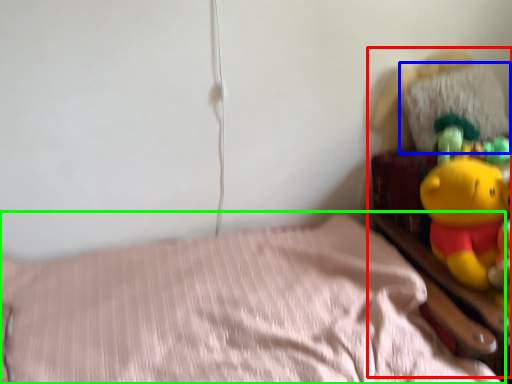
Question: Considering the real-world distances, which object is closest to toy (highlighted by a red box)? pillow (highlighted by a blue box) or bed (highlighted by a green box).

Choices:
 (A) pillow
 (B) bed

Answer: (A)